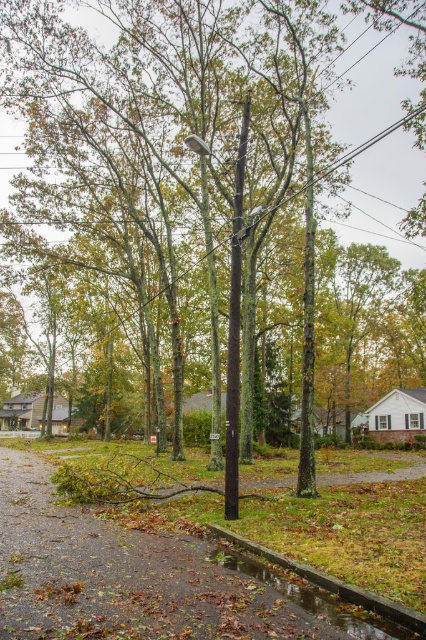
From the picture: You are driving a car and see the shiny reflective puddle at lower center and the metallic rectangular sign at center ahead. Which object will you hit first?

You will hit the shiny reflective puddle at lower center first because it is in front of the metallic rectangular sign at center.

You are a delivery driver trying to navigate through the storm. You see the shiny reflective puddle at lower center and the metallic rectangular sign at center. Which one is wider?

The shiny reflective puddle at lower center might be wider than the metallic rectangular sign at center, so it is possible that the puddle is wider.